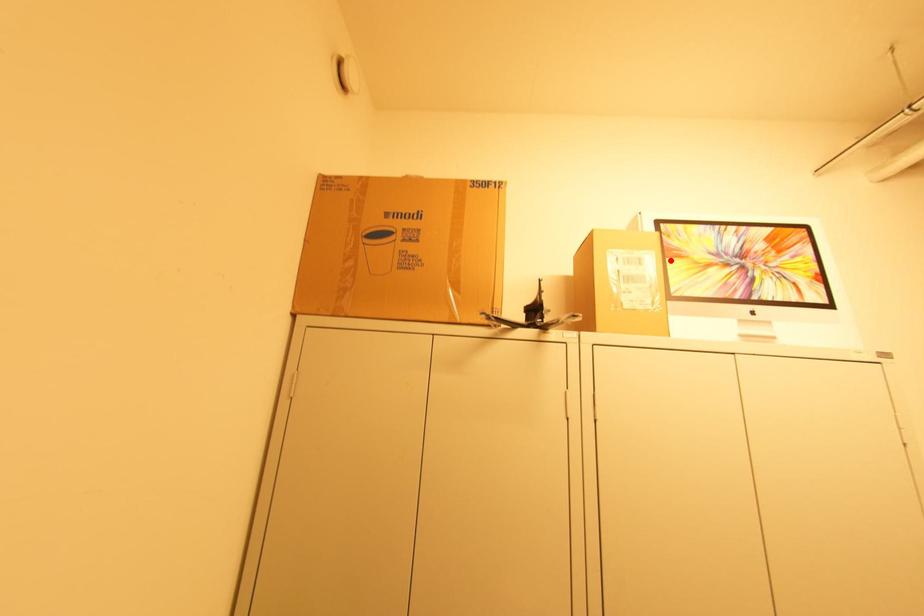
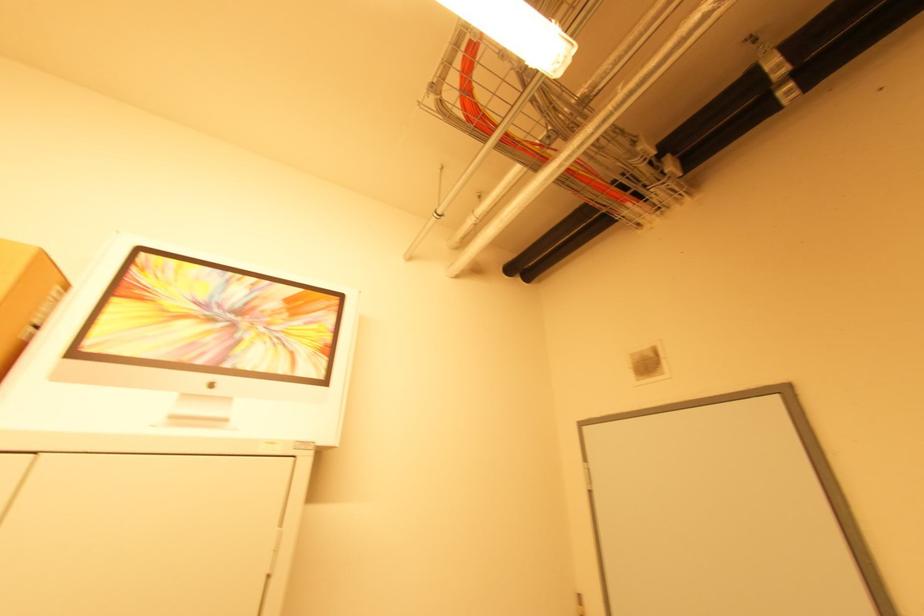
The point at the highlighted location is marked in the first image. Where is the corresponding point in the second image?

(117, 300)